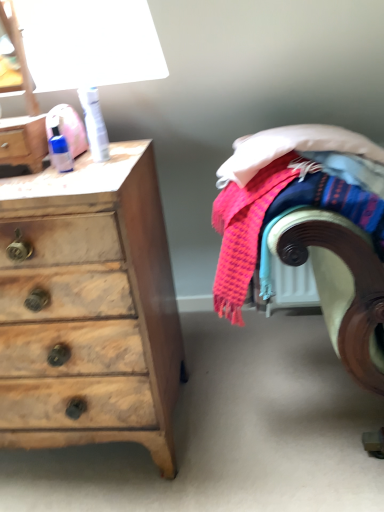
Find the location of a particular element. This screenshot has height=512, width=384. free location to the left of white plastic can at upper left, placed as the first toiletry when sorted from right to left is located at coordinates (47, 170).